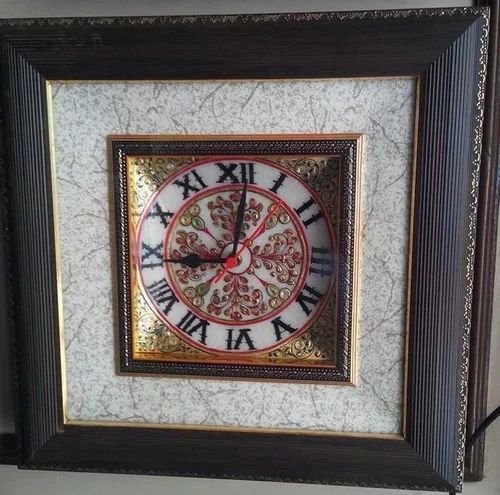
At what (x,y) coordinates should I click in order to perform the action: click on black electric cord on lower right side. Please return your answer as a coordinate pair (x, y). Looking at the image, I should click on (482, 433), (488, 416).